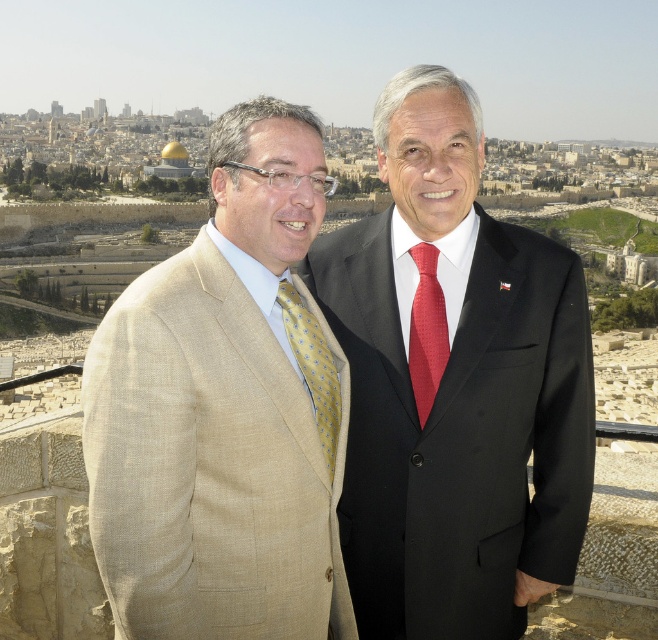
You are a tailor who needs to determine if the beige textured suit at center can be altered to fit through a narrow doorway that is only as wide as the yellow dotted silk tie at center. Can the suit be adjusted to fit through the doorway?

The beige textured suit at center might be wider than the yellow dotted silk tie at center, so it may not fit through the doorway unless adjusted to narrow its width.